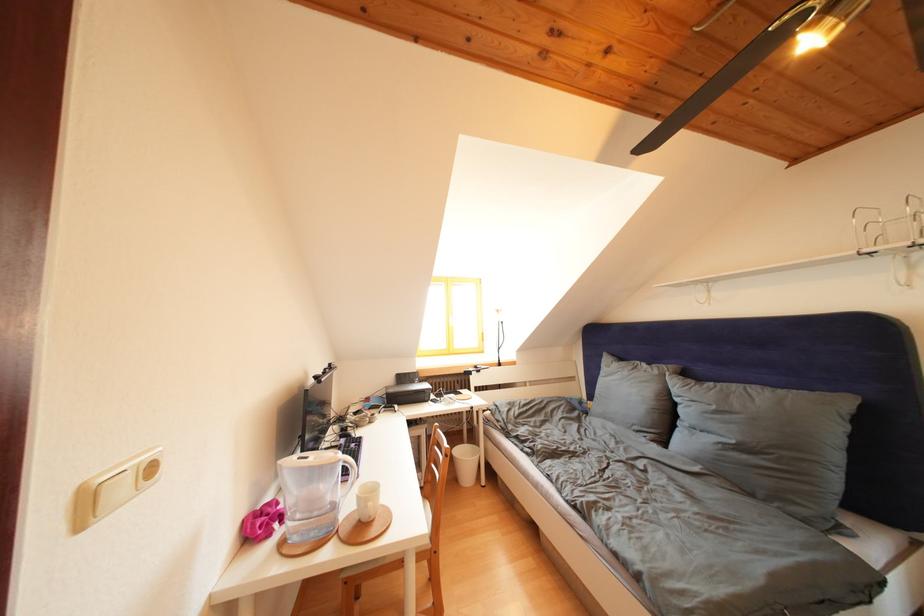
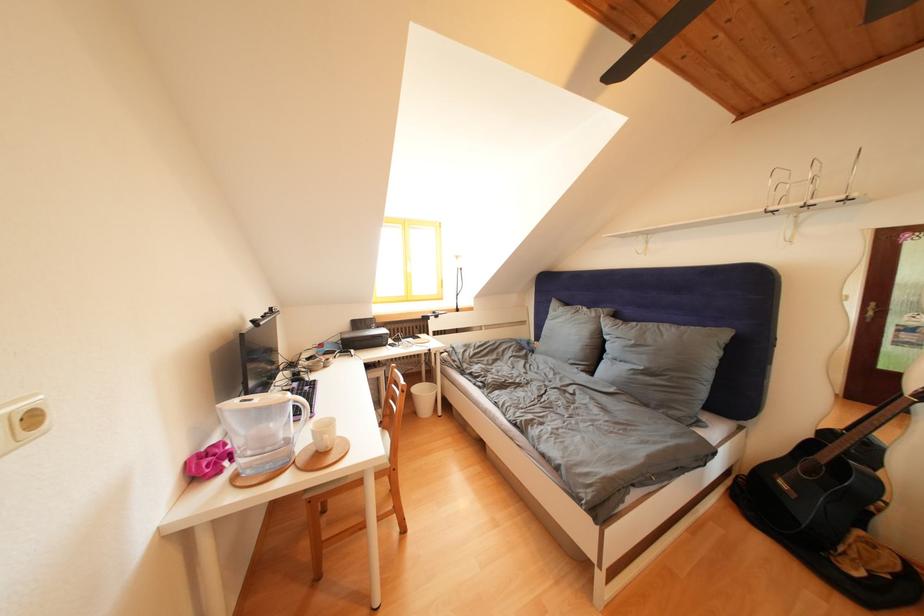
Question: I am providing you with two images of the same scene from different viewpoints. After the viewpoint changes to image2, which objects are now occluded?

Choices:
 (A) grey pillow
 (B) black webcam
 (C) white power outlet
 (D) none of these

Answer: (D)